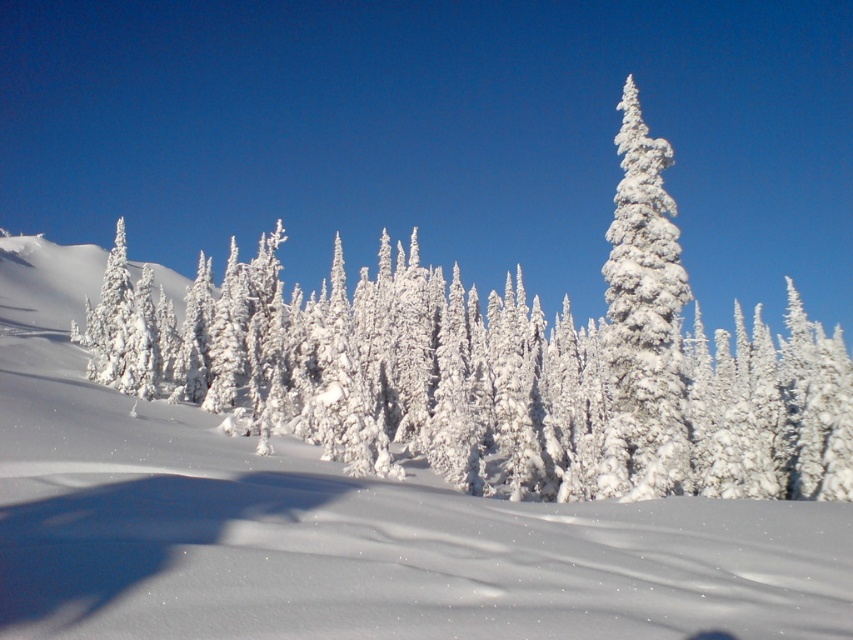
Question: Can you confirm if white snow-covered tree at center is bigger than white fluffy snow at center?

Choices:
 (A) no
 (B) yes

Answer: (B)

Question: Does white snow-covered tree at center appear on the right side of white fluffy tree at center?

Choices:
 (A) yes
 (B) no

Answer: (B)

Question: Which object is positioned closest to the white fluffy tree at center?

Choices:
 (A) white snow-covered tree at center
 (B) white fluffy snow at center

Answer: (A)

Question: From the image, what is the correct spatial relationship of white snow-covered tree at center in relation to white fluffy snow at center?

Choices:
 (A) above
 (B) below

Answer: (A)

Question: Which object is positioned farthest from the white fluffy snow at center?

Choices:
 (A) white snow-covered tree at center
 (B) white fluffy tree at center

Answer: (B)

Question: Which of the following is the closest to the observer?

Choices:
 (A) (326, 545)
 (B) (109, 296)

Answer: (A)